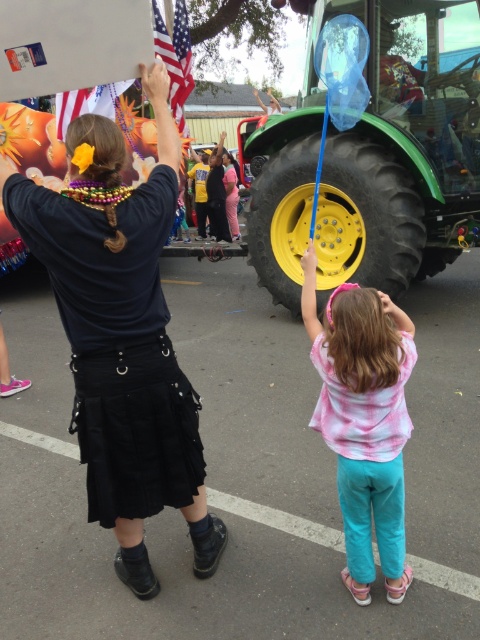
You are organizing a parade float and need to ensure visibility for all participants. Given the black leather skirt at center and the green rubber tractor at center, which object should be placed lower to avoid blocking the view of the other?

The black leather skirt at center has a lesser height compared to the green rubber tractor at center, so placing the black leather skirt at center lower would prevent it from blocking the view of the taller green rubber tractor at center.